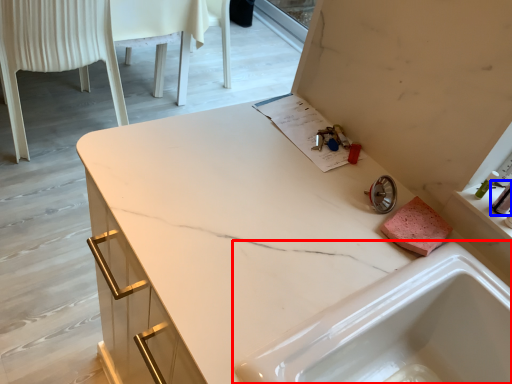
Question: Which point is closer to the camera, sink (highlighted by a red box) or toiletry (highlighted by a blue box)?

Choices:
 (A) sink
 (B) toiletry

Answer: (A)